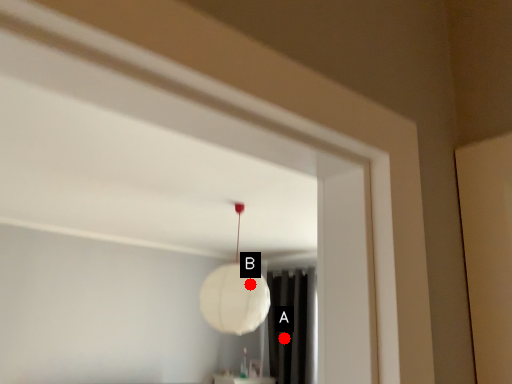
Question: Two points are circled on the image, labeled by A and B beside each circle. Which point appears farthest from the camera in this image?

Choices:
 (A) A is further
 (B) B is further

Answer: (A)